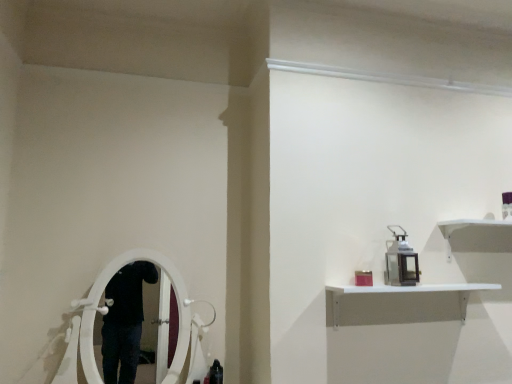
Find the location of a particular element. Image resolution: width=512 pixels, height=384 pixels. metal lantern at upper right is located at coordinates (401, 260).

Describe the element at coordinates (401, 260) in the screenshot. I see `metal lantern at upper right` at that location.

Measure the distance between point (451, 285) and camera.

The depth of point (451, 285) is 6.36 feet.

Locate an element on the screen. This screenshot has width=512, height=384. white matte shelf at upper right is located at coordinates (406, 293).

Image resolution: width=512 pixels, height=384 pixels. Describe the element at coordinates (406, 293) in the screenshot. I see `white matte shelf at upper right` at that location.

Identify the location of metal lantern at upper right. The width and height of the screenshot is (512, 384). (401, 260).

Does metal lantern at upper right appear on the right side of white matte shelf at upper right?

No, metal lantern at upper right is not to the right of white matte shelf at upper right.

Relative to white matte shelf at upper right, is metal lantern at upper right in front or behind?

In the image, metal lantern at upper right appears behind white matte shelf at upper right.

Which is closer to the camera, (396, 282) or (337, 320)?

Point (396, 282).

From the image's perspective, is metal lantern at upper right above or below white matte shelf at upper right?

From the image's perspective, metal lantern at upper right appears above white matte shelf at upper right.

From the picture: From a real-world perspective, who is located lower, metal lantern at upper right or white matte shelf at upper right?

In real-world perspective, white matte shelf at upper right is lower.

Considering the sizes of objects metal lantern at upper right and white matte shelf at upper right in the image provided, who is thinner, metal lantern at upper right or white matte shelf at upper right?

Thinner between the two is metal lantern at upper right.

In terms of height, does metal lantern at upper right look taller or shorter compared to white matte shelf at upper right?

Clearly, metal lantern at upper right is taller compared to white matte shelf at upper right.

Between metal lantern at upper right and white matte shelf at upper right, which one has smaller size?

With smaller size is metal lantern at upper right.

Which is correct: metal lantern at upper right is inside white matte shelf at upper right, or outside of it?

metal lantern at upper right cannot be found inside white matte shelf at upper right.

Are metal lantern at upper right and white matte shelf at upper right beside each other?

They are not placed beside each other.

Is white matte shelf at upper right at the back of metal lantern at upper right?

No, metal lantern at upper right's orientation is not away from white matte shelf at upper right.

How many degrees apart are the facing directions of metal lantern at upper right and white matte shelf at upper right?

The angle between the facing direction of metal lantern at upper right and the facing direction of white matte shelf at upper right is 2.59 degrees.

The image size is (512, 384). I want to click on shelf that is on the right side of metal lantern at upper right, so click(406, 293).

Considering the positions of objects white matte shelf at upper right and metal lantern at upper right in the image provided, who is more to the right, white matte shelf at upper right or metal lantern at upper right?

white matte shelf at upper right.

Considering the relative positions of white matte shelf at upper right and metal lantern at upper right in the image provided, is white matte shelf at upper right in front of metal lantern at upper right?

That is True.

Considering the points (441, 285) and (398, 256), which point is in front, point (441, 285) or point (398, 256)?

The point (441, 285) is in front.

From the image's perspective, between white matte shelf at upper right and metal lantern at upper right, which one is located above?

metal lantern at upper right appears higher in the image.

From a real-world perspective, is white matte shelf at upper right below metal lantern at upper right?

Yes, from a real-world perspective, white matte shelf at upper right is beneath metal lantern at upper right.

Considering the relative sizes of white matte shelf at upper right and metal lantern at upper right in the image provided, is white matte shelf at upper right thinner than metal lantern at upper right?

No.

Who is shorter, white matte shelf at upper right or metal lantern at upper right?

white matte shelf at upper right is shorter.

Between white matte shelf at upper right and metal lantern at upper right, which one has larger size?

Bigger between the two is white matte shelf at upper right.

Is white matte shelf at upper right positioned beyond the bounds of metal lantern at upper right?

Absolutely, white matte shelf at upper right is external to metal lantern at upper right.

Is white matte shelf at upper right directly adjacent to metal lantern at upper right?

No, white matte shelf at upper right is not touching metal lantern at upper right.

Is white matte shelf at upper right aimed at metal lantern at upper right?

No.

How different are the orientations of white matte shelf at upper right and metal lantern at upper right in degrees?

The angular difference between white matte shelf at upper right and metal lantern at upper right is 2.59 degrees.

What are the coordinates of `equipment behind the white matte shelf at upper right` in the screenshot? It's located at (401, 260).

Where is `equipment lying above the white matte shelf at upper right (from the image's perspective)`? The width and height of the screenshot is (512, 384). equipment lying above the white matte shelf at upper right (from the image's perspective) is located at coordinates [x=401, y=260].

Find the location of a particular element. This screenshot has height=384, width=512. equipment that is above the white matte shelf at upper right (from a real-world perspective) is located at coordinates (401, 260).